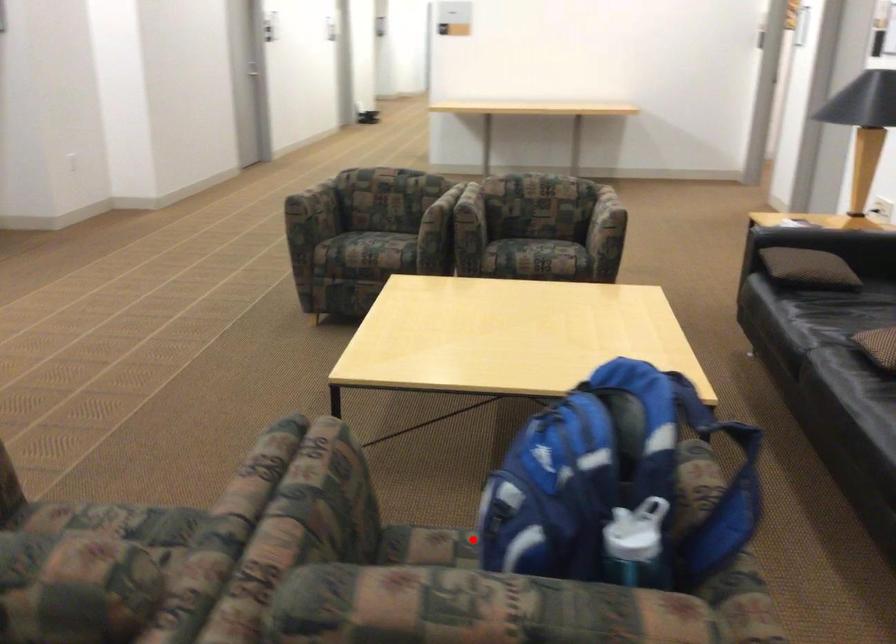
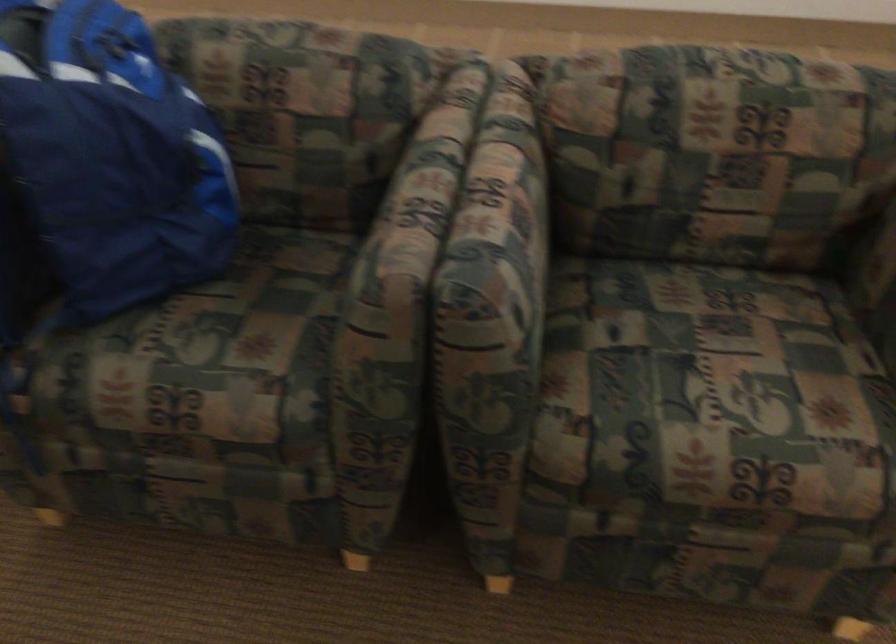
In the second image, find the point that corresponds to the highlighted location in the first image.

(199, 353)